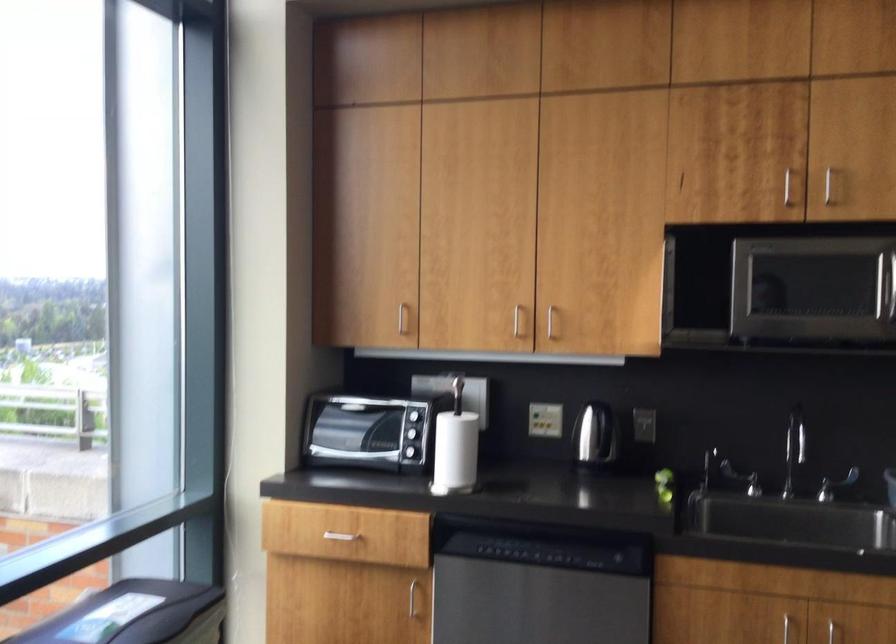
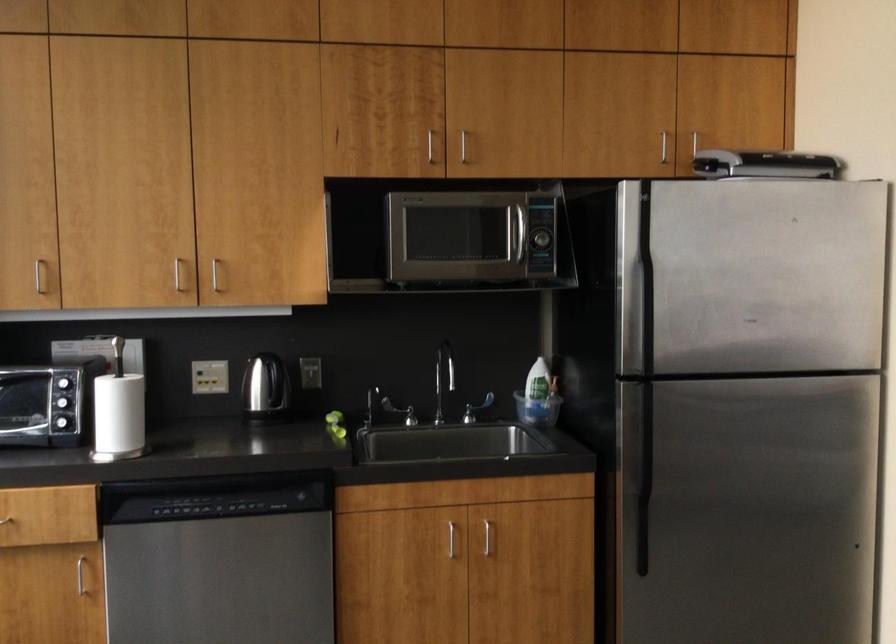
Find the pixel in the second image that matches (784,185) in the first image.

(431, 147)